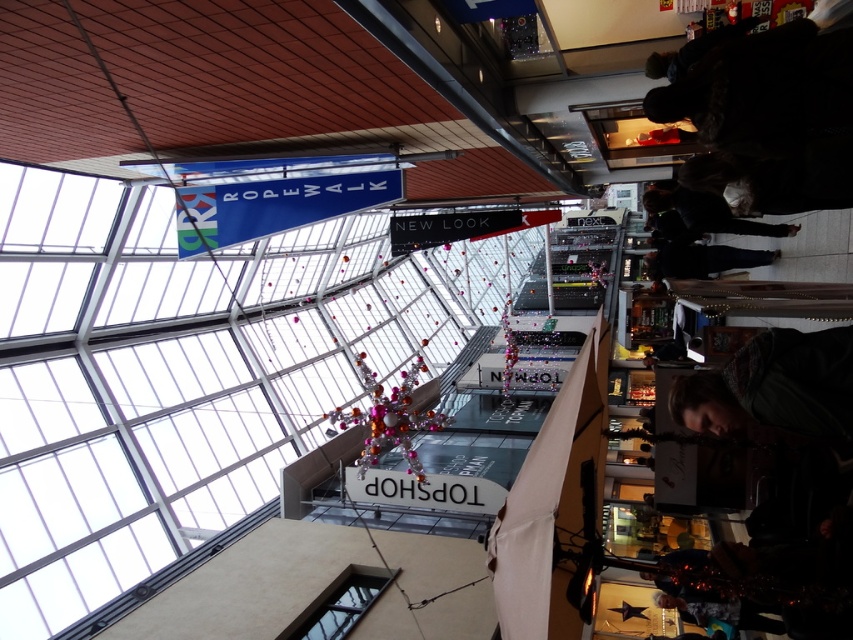
Image resolution: width=853 pixels, height=640 pixels. What do you see at coordinates (706, 212) in the screenshot? I see `dark brown leather jacket at center` at bounding box center [706, 212].

Between dark brown leather jacket at center and black fabric jacket at center, which one has more height?

Standing taller between the two is black fabric jacket at center.

I want to click on dark brown leather jacket at center, so click(x=706, y=212).

Is dark green sweater at lower right smaller than dark brown leather jacket at center?

Correct, dark green sweater at lower right occupies less space than dark brown leather jacket at center.

Who is taller, dark green sweater at lower right or dark brown leather jacket at center?

dark brown leather jacket at center

Is point (706, 401) more distant than point (730, 224)?

No.

At what (x,y) coordinates should I click in order to perform the action: click on dark green sweater at lower right. Please return your answer as a coordinate pair (x, y). The image size is (853, 640). Looking at the image, I should click on (775, 387).

Is point (762, 342) positioned before point (770, 259)?

Yes, it is in front of point (770, 259).

Between dark green sweater at lower right and black fabric jacket at center, which one has less height?

With less height is dark green sweater at lower right.

Locate an element on the screen. The image size is (853, 640). dark green sweater at lower right is located at coordinates (775, 387).

At what (x,y) coordinates should I click in order to perform the action: click on dark green sweater at lower right. Please return your answer as a coordinate pair (x, y). The height and width of the screenshot is (640, 853). Looking at the image, I should click on (775, 387).